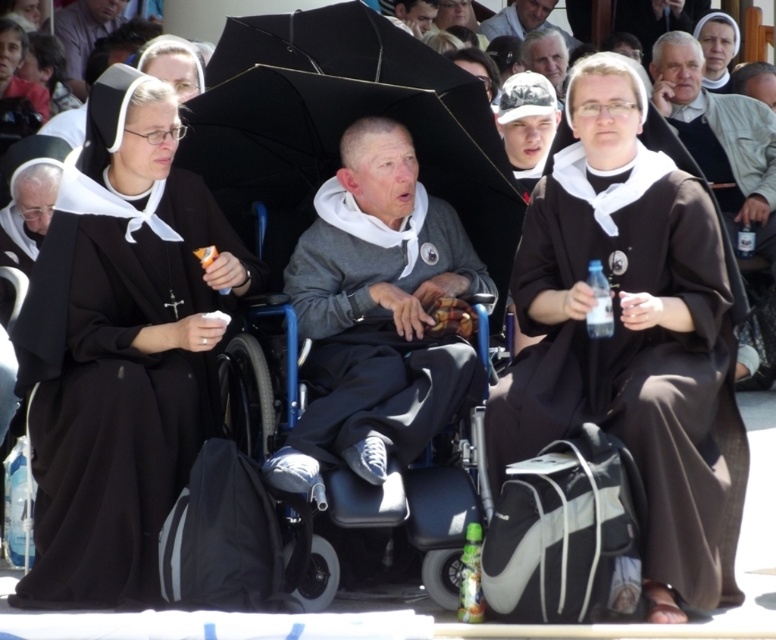
You are a photographer trying to capture a portrait of the brown matte nun at center and the smooth gray hair at upper center. Since you want to ensure both subjects are in focus, you need to know which one is taller. Can you determine which is taller?

The brown matte nun at center is taller than the smooth gray hair at upper center, so you should adjust your camera settings to focus on the taller subject first.

You are standing at point (x=570, y=45) and want to walk to the wheelchair in the center. Which direction should you move relative to point (x=674, y=605)?

You should move towards point (x=674, y=605) because it is in front of point (x=570, y=45), meaning the wheelchair is located in that direction.

You are a photographer trying to capture a photo of the brown matte nun at center and the gray fleece hoodie at center. Which one should you focus on first if you want to ensure both are in the frame without moving the camera?

The brown matte nun at center is much taller than the gray fleece hoodie at center, so you should focus on the taller brown matte nun at center first to ensure proper framing.